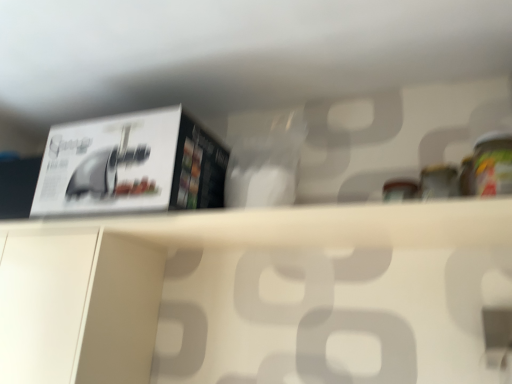
Question: From a real-world perspective, is white matte paper at upper left above or below white matte shelf at center?

Choices:
 (A) above
 (B) below

Answer: (A)

Question: In the image, is white matte paper at upper left on the left side or the right side of white matte shelf at center?

Choices:
 (A) left
 (B) right

Answer: (A)

Question: Considering the positions of point 192,119 and point 183,226, is point 192,119 closer or farther from the camera than point 183,226?

Choices:
 (A) farther
 (B) closer

Answer: (A)

Question: From a real-world perspective, relative to white matte paper at upper left, is white matte shelf at center vertically above or below?

Choices:
 (A) below
 (B) above

Answer: (A)

Question: In terms of width, does white matte shelf at center look wider or thinner when compared to white matte paper at upper left?

Choices:
 (A) thin
 (B) wide

Answer: (A)

Question: Considering their positions, is white matte shelf at center located in front of or behind white matte paper at upper left?

Choices:
 (A) front
 (B) behind

Answer: (A)

Question: In terms of height, does white matte shelf at center look taller or shorter compared to white matte paper at upper left?

Choices:
 (A) tall
 (B) short

Answer: (B)